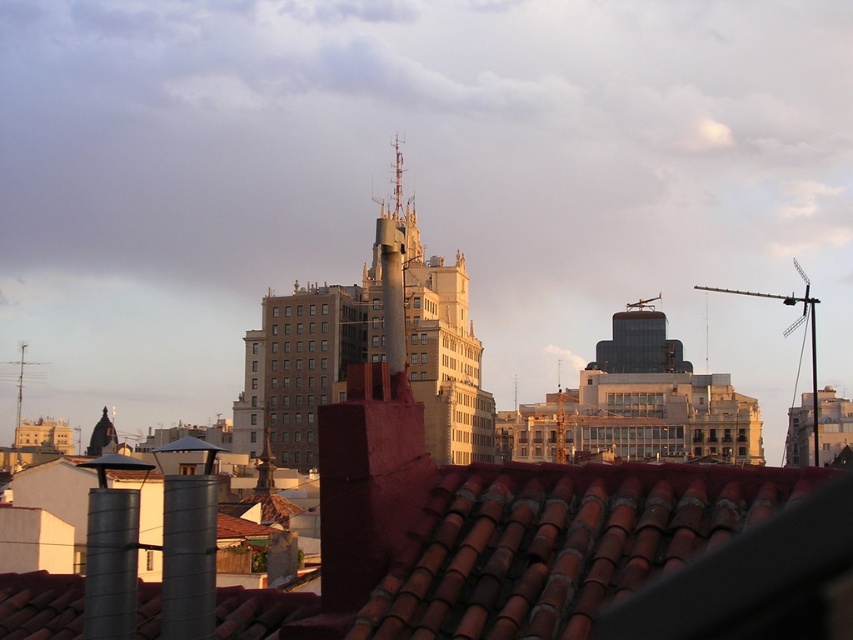
Does smooth concrete tower at center come behind metallic antenna at left?

No, smooth concrete tower at center is closer to the viewer.

Is smooth concrete tower at center positioned before metallic antenna at left?

Yes, smooth concrete tower at center is closer to the viewer.

Between point (311, 300) and point (39, 362), which one is positioned behind?

Point (39, 362)

Where is `smooth concrete tower at center`? smooth concrete tower at center is located at coordinates pos(369,353).

Is the position of brown tile roof at center less distant than that of smooth concrete tower at center?

Yes, brown tile roof at center is in front of smooth concrete tower at center.

Who is more distant from viewer, (647, 513) or (268, 432)?

The point (268, 432) is more distant.

At what (x,y) coordinates should I click in order to perform the action: click on brown tile roof at center. Please return your answer as a coordinate pair (x, y). Looking at the image, I should click on (558, 544).

Locate an element on the screen. This screenshot has width=853, height=640. brown tile roof at center is located at coordinates (558, 544).

Does brown tile roof at center have a lesser width compared to metallic antenna at left?

No.

Which is below, brown tile roof at center or metallic antenna at left?

Positioned lower is metallic antenna at left.

At what (x,y) coordinates should I click in order to perform the action: click on brown tile roof at center. Please return your answer as a coordinate pair (x, y). This screenshot has width=853, height=640. Looking at the image, I should click on (558, 544).